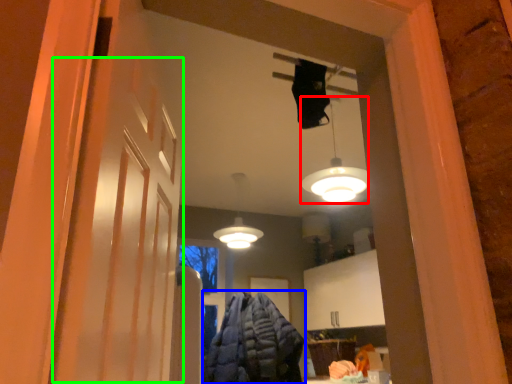
Question: Which is farther away from lamp (highlighted by a red box)? clothing (highlighted by a blue box) or barn door (highlighted by a green box)?

Choices:
 (A) clothing
 (B) barn door

Answer: (B)